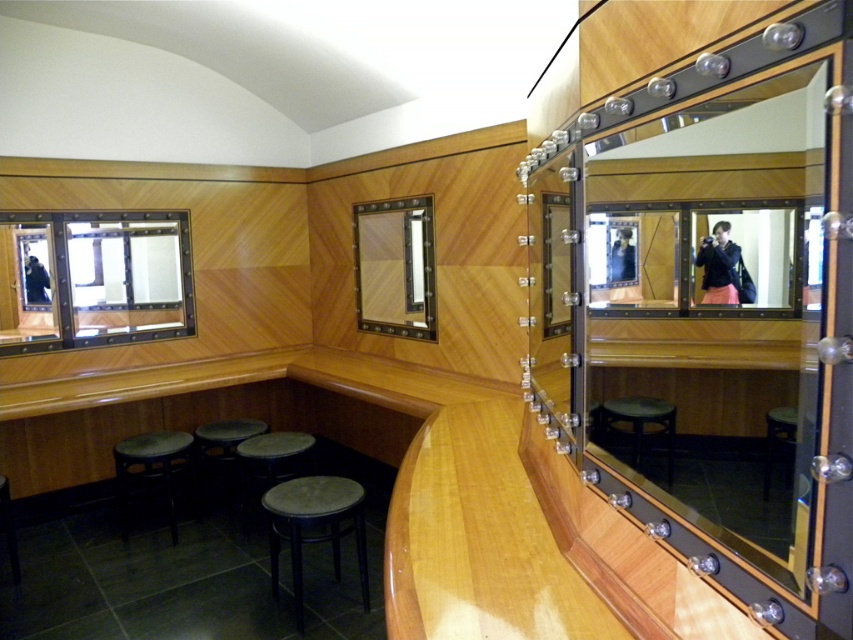
You are standing in the dressing room and want to determine which of the two points, point [730,256] or point [788,429], is closer to you. Based on the coordinates provided, which point is nearer?

Point [730,256] is further to the viewer than point [788,429], so the closer point to you is point [788,429].

Based on the photo, you are trying to decide which mirror to use for applying makeup. The matte black mirror at left and the matte wooden mirror at center are both available. Which mirror has a wider surface area for better visibility?

The matte black mirror at left has a larger width than the matte wooden mirror at center, so it provides a wider surface area for better visibility.

You are a fashion designer standing 5 feet away from the camera. You want to place a 38 inch long dress on the matte black jacket at center. Can the dress fit on the jacket without hanging off the edges?

The matte black jacket at center is 37.11 inches from the camera, which is shorter than the 38 inch long dress. The dress will hang off the edges of the jacket.